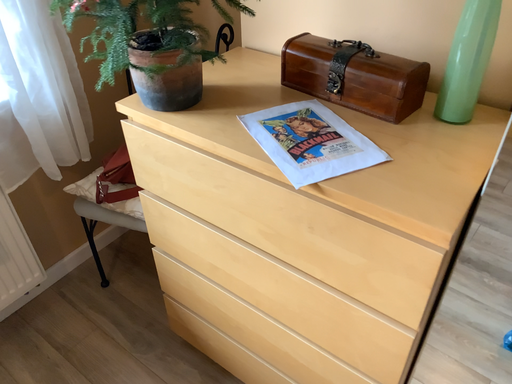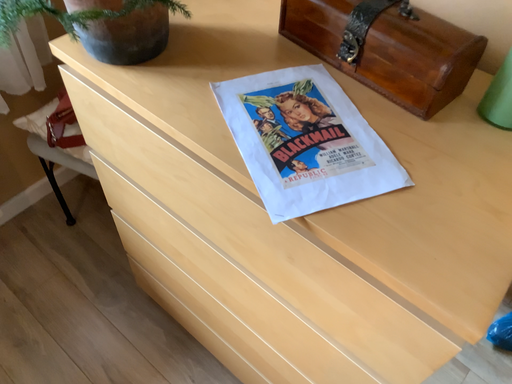
Question: How did the camera likely rotate when shooting the video?

Choices:
 (A) rotated upward
 (B) rotated downward

Answer: (B)